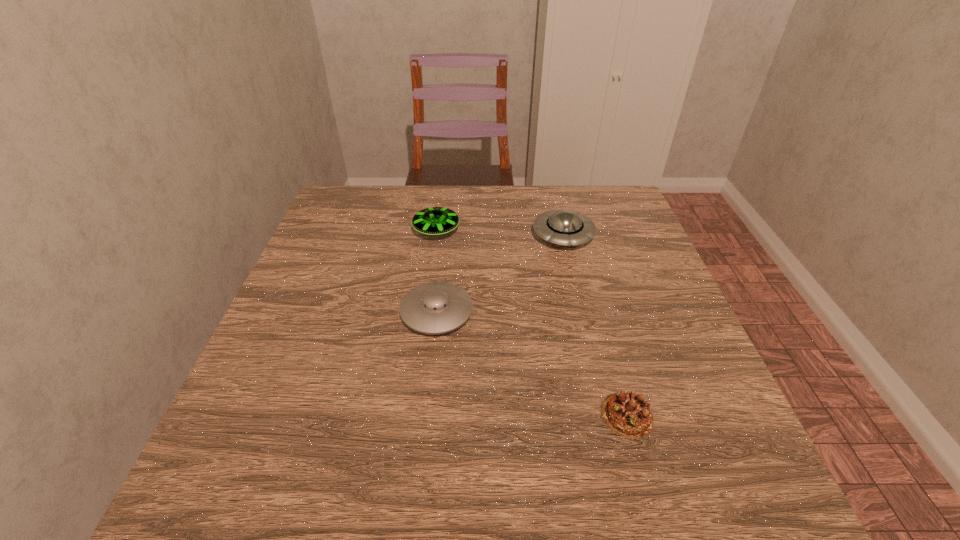
Identify the location of object that is at the far right corner. This screenshot has height=540, width=960. (565, 227).

The image size is (960, 540). What are the coordinates of `free space at the far edge` in the screenshot? It's located at coord(523,198).

I want to click on vacant space at the near edge, so click(334, 509).

At what (x,y) coordinates should I click in order to perform the action: click on vacant space at the left edge. Please return your answer as a coordinate pair (x, y). Looking at the image, I should click on (314, 293).

Where is `vacant space at the right edge`? The image size is (960, 540). vacant space at the right edge is located at coordinates (658, 377).

In the image, there is a desktop. Where is `vacant space at the far left corner`? This screenshot has width=960, height=540. vacant space at the far left corner is located at coordinates (373, 201).

In the image, there is a desktop. Identify the location of vacant space at the far right corner. This screenshot has height=540, width=960. [629, 233].

Find the location of `vacant space at the near right corner of the desktop`. vacant space at the near right corner of the desktop is located at coordinates (730, 462).

Identify the location of unoccupied position between the rightmost saucer and the shortest object. (595, 325).

This screenshot has height=540, width=960. In order to click on vacant space that's between the third tallest object and the chocolate cake in this screenshot , I will do click(532, 363).